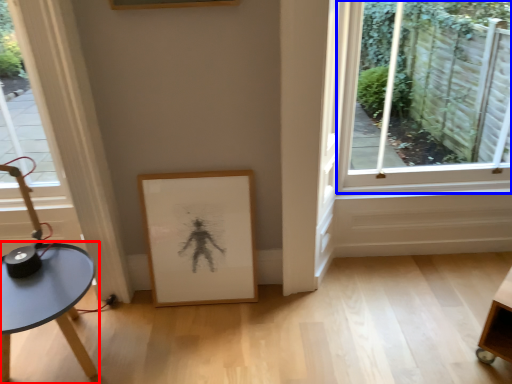
Question: Which of the following is the closest to the observer, table (highlighted by a red box) or window (highlighted by a blue box)?

Choices:
 (A) table
 (B) window

Answer: (A)